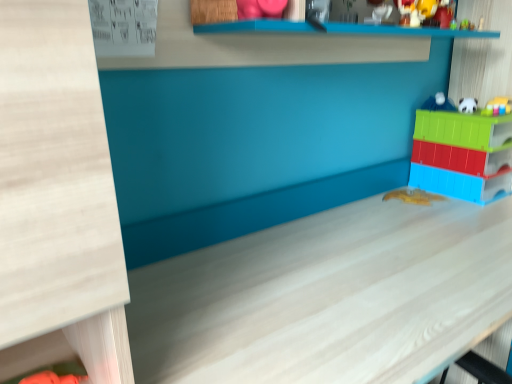
Find the location of a particular element. This screenshot has width=512, height=384. empty space that is ontop of translucent plastic toy at right, which ranks as the 4th toy in top-to-bottom order (from a real-world perspective) is located at coordinates (466, 110).